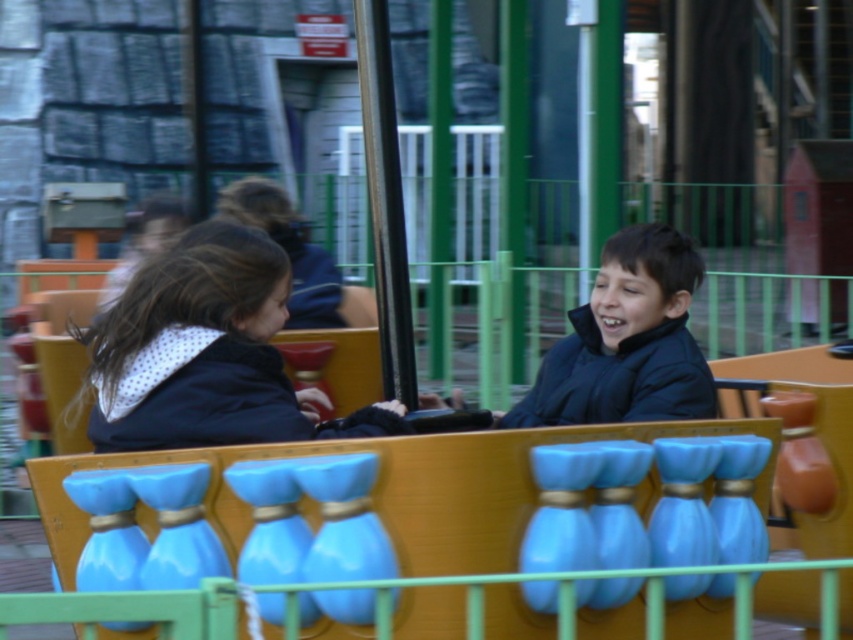
Measure the distance between point (216, 396) and camera.

A: Point (216, 396) and camera are 22.80 feet apart from each other.

Does matte black jacket at left have a lesser height compared to black matte jacket at center?

No, matte black jacket at left is not shorter than black matte jacket at center.

What do you see at coordinates (206, 353) in the screenshot? I see `matte black jacket at left` at bounding box center [206, 353].

The height and width of the screenshot is (640, 853). I want to click on matte black jacket at left, so click(x=206, y=353).